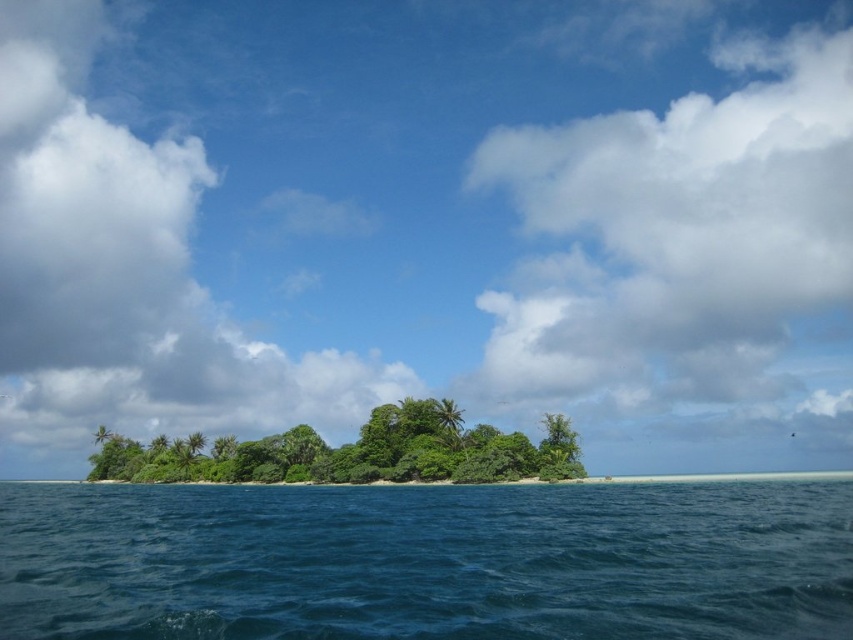
Question: Is deep blue water at center positioned in front of green leafy trees at center?

Choices:
 (A) yes
 (B) no

Answer: (A)

Question: Which point is closer to the camera taking this photo?

Choices:
 (A) (721, 536)
 (B) (405, 480)

Answer: (A)

Question: Does deep blue water at center appear under green leafy trees at center?

Choices:
 (A) no
 (B) yes

Answer: (A)

Question: Does deep blue water at center appear on the right side of green leafy trees at center?

Choices:
 (A) yes
 (B) no

Answer: (A)